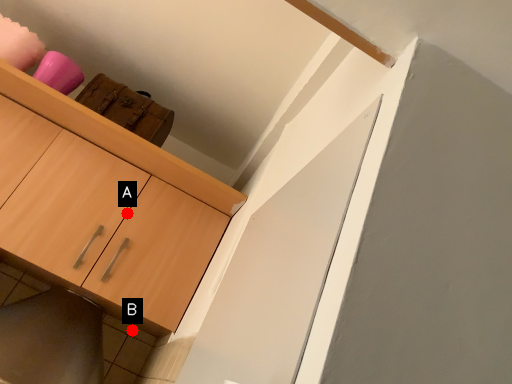
Question: Two points are circled on the image, labeled by A and B beside each circle. Which of the following is the farthest from the observer?

Choices:
 (A) A is further
 (B) B is further

Answer: (B)